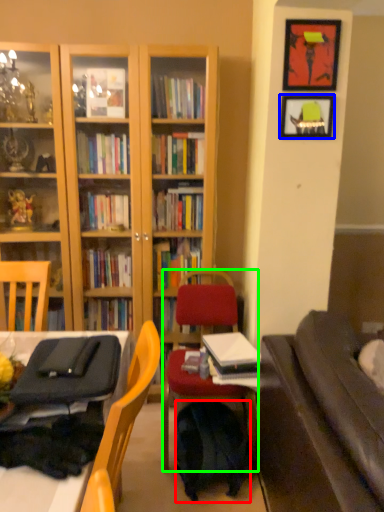
Question: Which object is positioned closest to backpack (highlighted by a red box)? Select from picture frame (highlighted by a blue box) and chair (highlighted by a green box).

Choices:
 (A) picture frame
 (B) chair

Answer: (B)